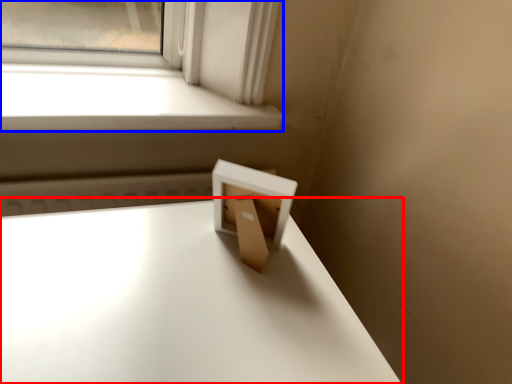
Question: Which object is further to the camera taking this photo, table (highlighted by a red box) or window (highlighted by a blue box)?

Choices:
 (A) table
 (B) window

Answer: (B)